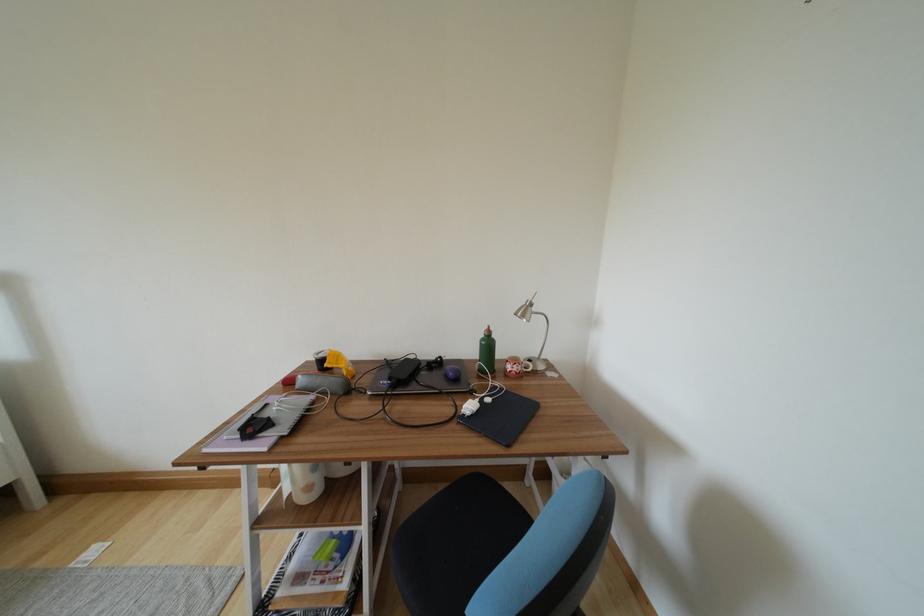
Locate an element on the screen. Image resolution: width=924 pixels, height=616 pixels. silver lamp head is located at coordinates (525, 310).